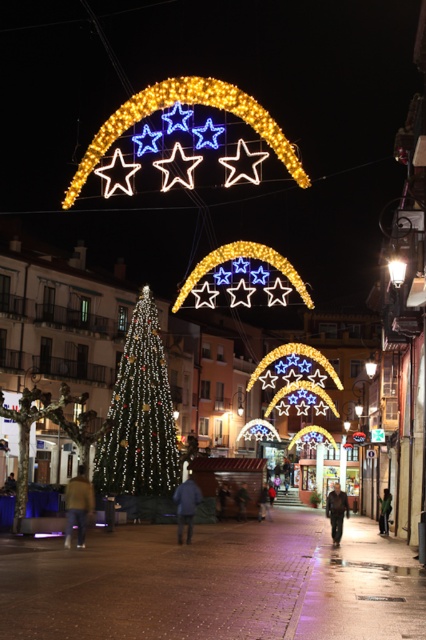
You are standing in the festive nighttime scene and notice a dark gray jacket at center. Can you determine its exact location based on the coordinates provided?

The dark gray jacket at center is located at point coordinates of 0.800 in the x and 0.791 in the y direction.